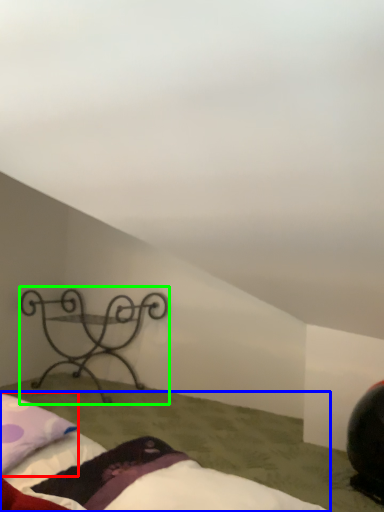
Question: Based on their relative distances, which object is nearer to pillow (highlighted by a red box)? Choose from bed (highlighted by a blue box) and furniture (highlighted by a green box).

Choices:
 (A) bed
 (B) furniture

Answer: (A)